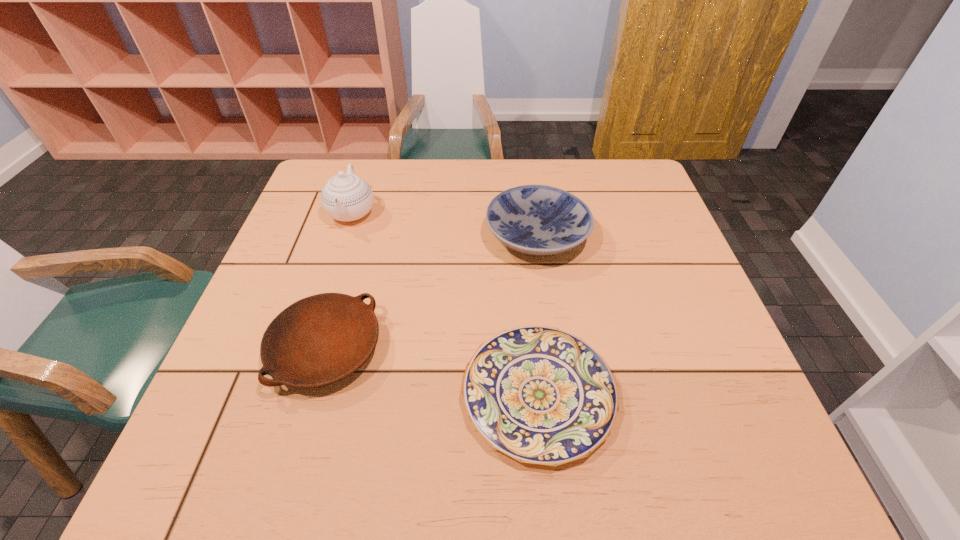
Find the location of a particular element. The height and width of the screenshot is (540, 960). chinaware is located at coordinates (346, 197).

This screenshot has width=960, height=540. I want to click on the third shortest object, so click(539, 220).

What are the coordinates of `the tallest plate` in the screenshot? It's located at (539, 220).

The width and height of the screenshot is (960, 540). Find the location of `the leftmost plate`. the leftmost plate is located at coordinates (319, 340).

Where is `the second shortest object`? the second shortest object is located at coordinates (319, 340).

Image resolution: width=960 pixels, height=540 pixels. In order to click on the shortest plate in this screenshot , I will do `click(538, 394)`.

Locate an element on the screen. This screenshot has width=960, height=540. vacant position located on the spout of the tallest object is located at coordinates (329, 281).

This screenshot has height=540, width=960. I want to click on vacant space situated on the front of the farthest plate, so click(557, 381).

This screenshot has height=540, width=960. Find the location of `free location located 0.060m on the right of the second shortest object`. free location located 0.060m on the right of the second shortest object is located at coordinates (410, 349).

Locate an element on the screen. The image size is (960, 540). vacant space located on the right of the shortest object is located at coordinates (733, 395).